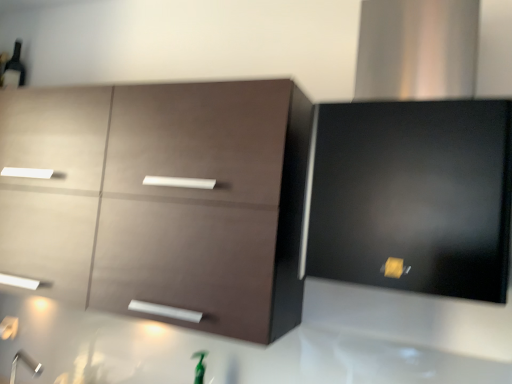
Question: From a real-world perspective, is satin black range hood at upper right, which ranks as the 1th cabinetry in right-to-left order, under matte brown cabinet at upper left, the 1th cabinetry from the left?

Choices:
 (A) yes
 (B) no

Answer: (B)

Question: Does satin black range hood at upper right, which ranks as the 1th cabinetry in right-to-left order, have a larger size compared to matte brown cabinet at upper left, the 1th cabinetry from the left?

Choices:
 (A) yes
 (B) no

Answer: (B)

Question: Would you consider satin black range hood at upper right, the 2th cabinetry in the left-to-right sequence, to be distant from matte brown cabinet at upper left, the 1th cabinetry from the left?

Choices:
 (A) no
 (B) yes

Answer: (A)

Question: Is satin black range hood at upper right, the 2th cabinetry in the left-to-right sequence, further to camera compared to matte brown cabinet at upper left, the 1th cabinetry from the left?

Choices:
 (A) no
 (B) yes

Answer: (A)

Question: Is satin black range hood at upper right, which ranks as the 1th cabinetry in right-to-left order, with matte brown cabinet at upper left, the 1th cabinetry from the left?

Choices:
 (A) yes
 (B) no

Answer: (B)

Question: From a real-world perspective, is satin black range hood at upper right, which ranks as the 1th cabinetry in right-to-left order, physically above matte brown cabinet at upper left, the 1th cabinetry from the left?

Choices:
 (A) no
 (B) yes

Answer: (B)

Question: From a real-world perspective, is satin black range hood at upper right, the 2th cabinetry in the left-to-right sequence, physically above matte black beer bottle at upper left?

Choices:
 (A) yes
 (B) no

Answer: (B)

Question: Considering the relative sizes of satin black range hood at upper right, which ranks as the 1th cabinetry in right-to-left order, and matte black beer bottle at upper left in the image provided, is satin black range hood at upper right, which ranks as the 1th cabinetry in right-to-left order, shorter than matte black beer bottle at upper left?

Choices:
 (A) yes
 (B) no

Answer: (B)

Question: Is satin black range hood at upper right, the 2th cabinetry in the left-to-right sequence, at the left side of matte black beer bottle at upper left?

Choices:
 (A) yes
 (B) no

Answer: (B)

Question: Considering the relative sizes of satin black range hood at upper right, the 2th cabinetry in the left-to-right sequence, and matte black beer bottle at upper left in the image provided, is satin black range hood at upper right, the 2th cabinetry in the left-to-right sequence, thinner than matte black beer bottle at upper left?

Choices:
 (A) yes
 (B) no

Answer: (B)

Question: Does satin black range hood at upper right, the 2th cabinetry in the left-to-right sequence, have a larger size compared to matte black beer bottle at upper left?

Choices:
 (A) no
 (B) yes

Answer: (B)

Question: Considering the relative sizes of satin black range hood at upper right, which ranks as the 1th cabinetry in right-to-left order, and matte black beer bottle at upper left in the image provided, is satin black range hood at upper right, which ranks as the 1th cabinetry in right-to-left order, smaller than matte black beer bottle at upper left?

Choices:
 (A) no
 (B) yes

Answer: (A)

Question: From the image's perspective, is matte brown cabinet at upper left, the 1th cabinetry from the left, below matte black beer bottle at upper left?

Choices:
 (A) yes
 (B) no

Answer: (A)